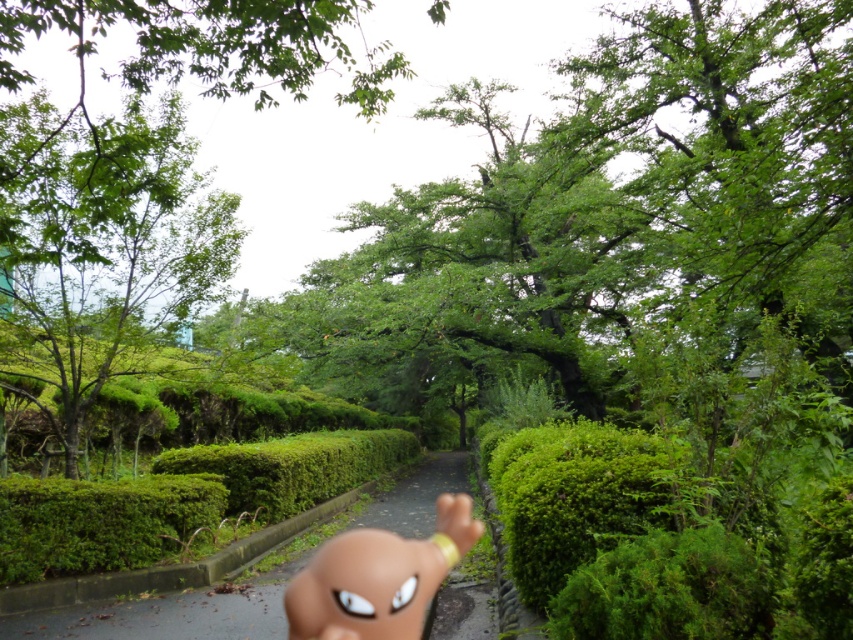
Identify the location of green hedge at center. This screenshot has width=853, height=640. (167, 612).

Which is more to the left, green hedge at center or brown matte doll at center?

green hedge at center

Is point (445, 474) positioned behind point (386, 589)?

That is True.

You are a GUI agent. You are given a task and a screenshot of the screen. Output one action in this format:
    pyautogui.click(x=<x>, y=<y>)
    Task: Click on the green hedge at center
    
    Given the screenshot: What is the action you would take?
    pyautogui.click(x=167, y=612)

Between point (508, 465) and point (431, 592), which one is positioned in front?

Point (431, 592) is more forward.

Between green leafy bush at center and brown matte doll at center, which one has more height?

Standing taller between the two is green leafy bush at center.

Which is behind, point (659, 470) or point (428, 570)?

The point (428, 570) is behind.

At what (x,y) coordinates should I click in order to perform the action: click on green leafy bush at center. Please return your answer as a coordinate pair (x, y). The width and height of the screenshot is (853, 640). Looking at the image, I should click on (583, 496).

Which of these two, green leafy bush at center or green hedge at center, stands shorter?

green leafy bush at center is shorter.

Is point (514, 520) behind point (270, 612)?

That is False.

You are a GUI agent. You are given a task and a screenshot of the screen. Output one action in this format:
    pyautogui.click(x=<x>, y=<y>)
    Task: Click on the green leafy bush at center
    
    Given the screenshot: What is the action you would take?
    pyautogui.click(x=583, y=496)